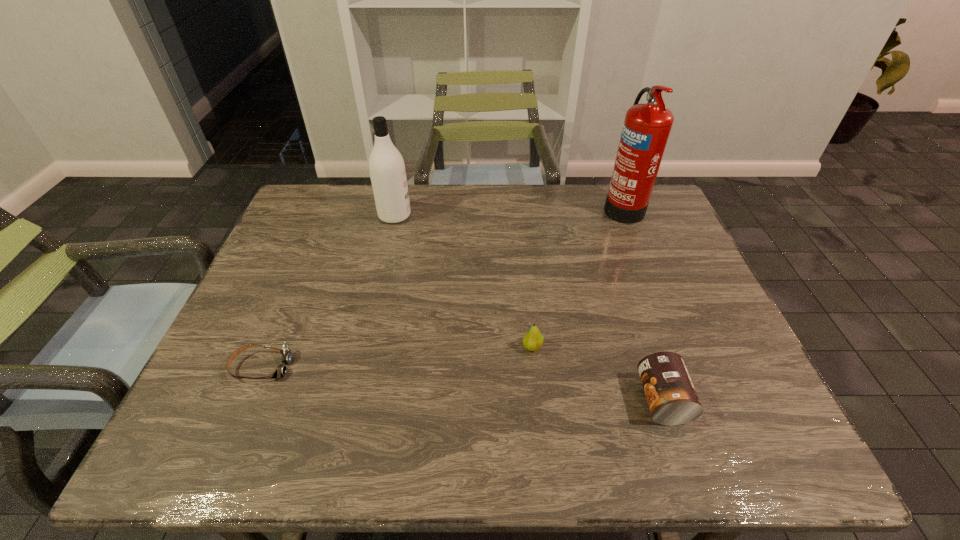
The image size is (960, 540). I want to click on object that is at the right edge, so click(x=646, y=128).

Locate an element on the screen. Image resolution: width=960 pixels, height=540 pixels. object that is at the far right corner is located at coordinates tap(646, 128).

Locate an element on the screen. free space at the far edge is located at coordinates (535, 192).

You are a GUI agent. You are given a task and a screenshot of the screen. Output one action in this format:
    pyautogui.click(x=<x>, y=<y>)
    Task: Click on the vacant region at the near edge of the desktop
    The width and height of the screenshot is (960, 540).
    Given the screenshot: What is the action you would take?
    pyautogui.click(x=534, y=451)

I want to click on blank space at the left edge of the desktop, so click(x=264, y=314).

In the image, there is a desktop. Where is `free space at the far left corner`? Image resolution: width=960 pixels, height=540 pixels. free space at the far left corner is located at coordinates (333, 208).

I want to click on empty space that is in between the shampoo and the third object from left to right, so click(x=464, y=281).

Identify the location of free space between the second object from left to right and the shortest object. This screenshot has height=540, width=960. (328, 291).

Locate an element on the screen. Image resolution: width=960 pixels, height=540 pixels. vacant point located between the fourth shortest object and the tallest object is located at coordinates (509, 211).

Where is `free area in between the third object from right to left and the shampoo`? free area in between the third object from right to left and the shampoo is located at coordinates [x=464, y=281].